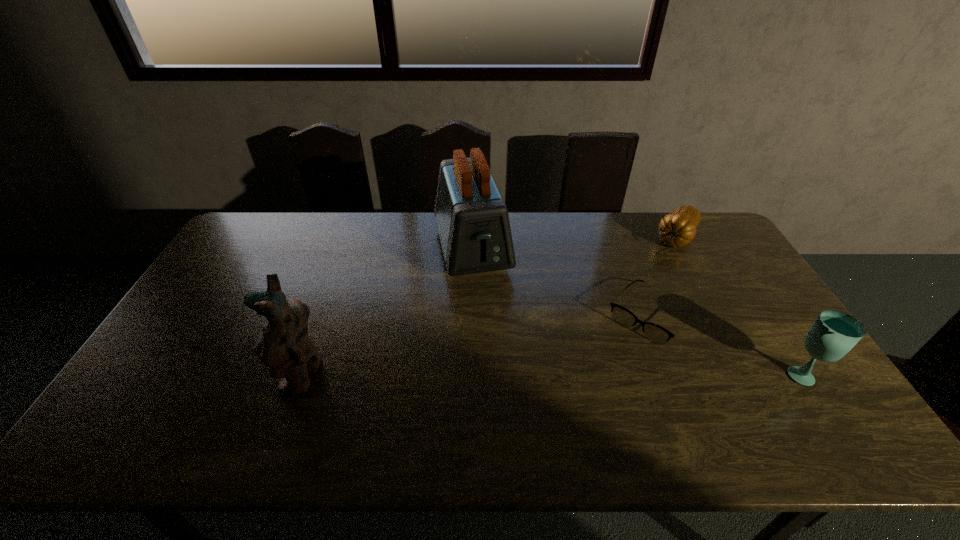
Locate an element on the screen. This screenshot has width=960, height=540. free spot on the desktop that is between the figurine and the third tallest object and is positioned on the face of the spectacles is located at coordinates (603, 375).

What are the coordinates of `free spot on the desktop that is between the leftmost object and the third shortest object and is positioned on the front-facing side of the toaster` in the screenshot? It's located at (511, 375).

Where is `free space on the desktop that is between the figurine and the third shortest object and is positioned on the stem side of the gourd`? The width and height of the screenshot is (960, 540). free space on the desktop that is between the figurine and the third shortest object and is positioned on the stem side of the gourd is located at coordinates (583, 375).